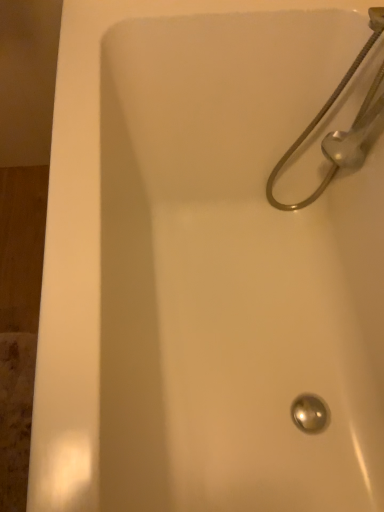
Describe the element at coordinates (321, 118) in the screenshot. I see `brushed metal shower head at upper right` at that location.

What are the coordinates of `brushed metal shower head at upper right` in the screenshot? It's located at (321, 118).

The image size is (384, 512). What are the coordinates of `brushed metal shower head at upper right` in the screenshot? It's located at (321, 118).